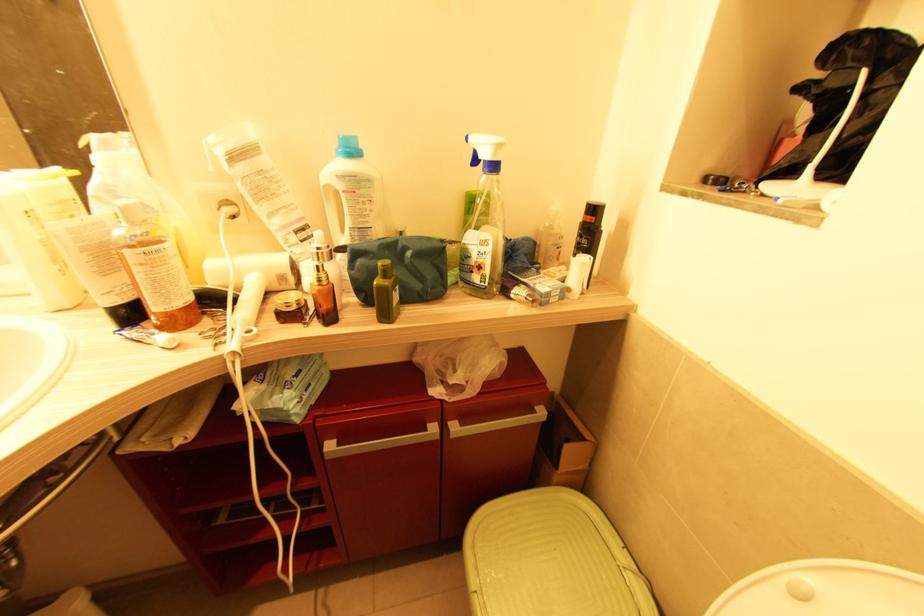
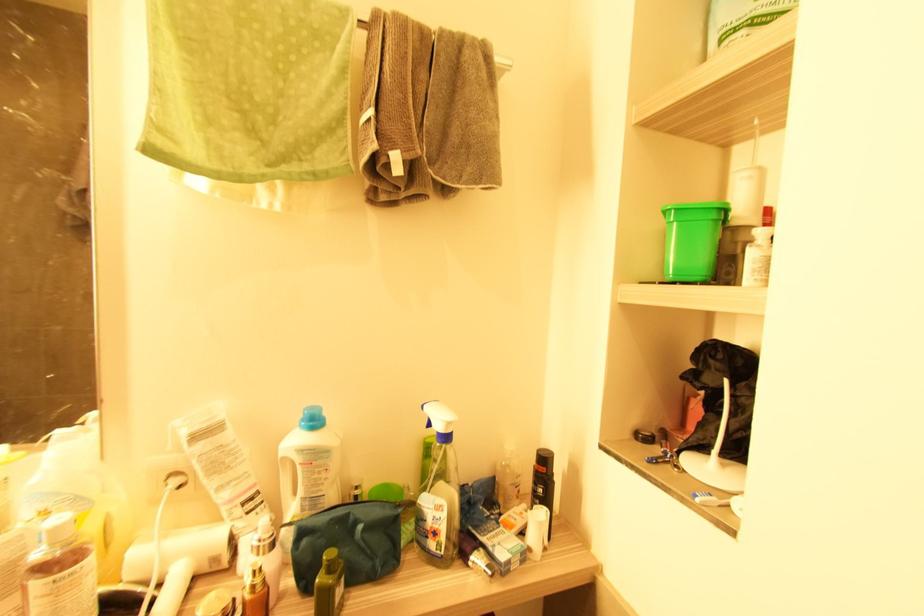
Where in the second image is the point corresponding to the point at 319,254 from the first image?

(261, 546)